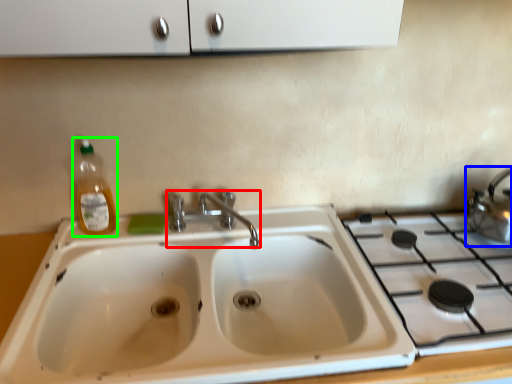
Question: Which object is positioned farthest from tap (highlighted by a red box)? Select from tea pot (highlighted by a blue box) and bottle (highlighted by a green box).

Choices:
 (A) tea pot
 (B) bottle

Answer: (A)